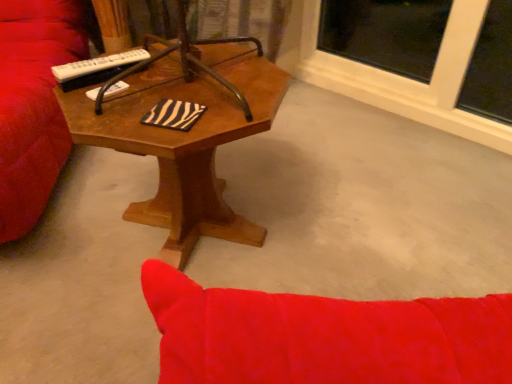
The height and width of the screenshot is (384, 512). What do you see at coordinates (185, 140) in the screenshot?
I see `wooden coffee table at center` at bounding box center [185, 140].

Where is `wooden coffee table at center`? Image resolution: width=512 pixels, height=384 pixels. wooden coffee table at center is located at coordinates (185, 140).

This screenshot has height=384, width=512. What do you see at coordinates (97, 64) in the screenshot?
I see `white plastic remote at upper left` at bounding box center [97, 64].

Identify the location of white plastic remote at upper left. (97, 64).

Where is `wooden coffee table at center`? This screenshot has width=512, height=384. wooden coffee table at center is located at coordinates (185, 140).

Which object is positioned more to the right, white plastic remote at upper left or wooden coffee table at center?

From the viewer's perspective, wooden coffee table at center appears more on the right side.

Is white plastic remote at upper left in front of or behind wooden coffee table at center in the image?

In the image, white plastic remote at upper left appears behind wooden coffee table at center.

Which point is more distant from viewer, (130, 55) or (180, 194)?

The point (180, 194) is farther.

From the image's perspective, is white plastic remote at upper left over wooden coffee table at center?

Yes, from the image's perspective, white plastic remote at upper left is over wooden coffee table at center.

From a real-world perspective, is white plastic remote at upper left located beneath wooden coffee table at center?

No, from a real-world perspective, white plastic remote at upper left is not beneath wooden coffee table at center.

Which object is thinner, white plastic remote at upper left or wooden coffee table at center?

white plastic remote at upper left.

From their relative heights in the image, would you say white plastic remote at upper left is taller or shorter than wooden coffee table at center?

Considering their sizes, white plastic remote at upper left has less height than wooden coffee table at center.

Between white plastic remote at upper left and wooden coffee table at center, which one has larger size?

wooden coffee table at center.

Is wooden coffee table at center a part of white plastic remote at upper left?

Actually, wooden coffee table at center is outside white plastic remote at upper left.

Are white plastic remote at upper left and wooden coffee table at center beside each other?

No, white plastic remote at upper left is not with wooden coffee table at center.

Could you tell me if white plastic remote at upper left is turned towards wooden coffee table at center?

Yes, white plastic remote at upper left is oriented towards wooden coffee table at center.

The width and height of the screenshot is (512, 384). Find the location of `remote control that is behind the wooden coffee table at center`. remote control that is behind the wooden coffee table at center is located at coordinates (97, 64).

Is wooden coffee table at center to the left or to the right of white plastic remote at upper left in the image?

wooden coffee table at center is positioned on white plastic remote at upper left's right side.

Considering the relative positions of wooden coffee table at center and white plastic remote at upper left in the image provided, is wooden coffee table at center behind white plastic remote at upper left?

No, the depth of wooden coffee table at center is less than that of white plastic remote at upper left.

Is point (179, 168) behind point (131, 59)?

Yes.

From the image's perspective, between wooden coffee table at center and white plastic remote at upper left, which one is located above?

white plastic remote at upper left appears higher in the image.

From a real-world perspective, is wooden coffee table at center located beneath white plastic remote at upper left?

Yes, from a real-world perspective, wooden coffee table at center is beneath white plastic remote at upper left.

From the picture: Considering the sizes of objects wooden coffee table at center and white plastic remote at upper left in the image provided, who is wider, wooden coffee table at center or white plastic remote at upper left?

Wider between the two is wooden coffee table at center.

Based on the photo, who is shorter, wooden coffee table at center or white plastic remote at upper left?

white plastic remote at upper left.

Can you confirm if wooden coffee table at center is bigger than white plastic remote at upper left?

Correct, wooden coffee table at center is larger in size than white plastic remote at upper left.

Is white plastic remote at upper left a part of wooden coffee table at center?

Yes, wooden coffee table at center contains white plastic remote at upper left.

Would you consider wooden coffee table at center to be distant from white plastic remote at upper left?

No, wooden coffee table at center is in close proximity to white plastic remote at upper left.

Is wooden coffee table at center oriented towards white plastic remote at upper left?

No, wooden coffee table at center does not turn towards white plastic remote at upper left.

Where is `remote control on the left of the wooden coffee table at center`? Image resolution: width=512 pixels, height=384 pixels. remote control on the left of the wooden coffee table at center is located at coordinates (97, 64).

Where is `remote control above the wooden coffee table at center (from a real-world perspective)`? The height and width of the screenshot is (384, 512). remote control above the wooden coffee table at center (from a real-world perspective) is located at coordinates (97, 64).

In the image, there is a white plastic remote at upper left. Identify the location of coffee table below it (from a real-world perspective). (185, 140).